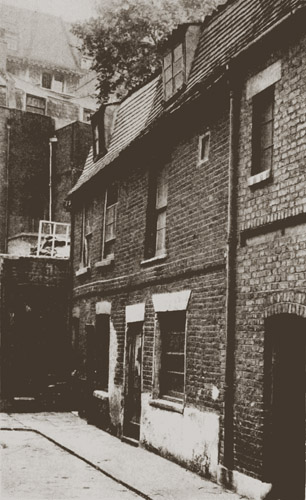
Where is `window`? This screenshot has width=306, height=500. window is located at coordinates (86, 246), (109, 222), (159, 193), (263, 152), (179, 377).